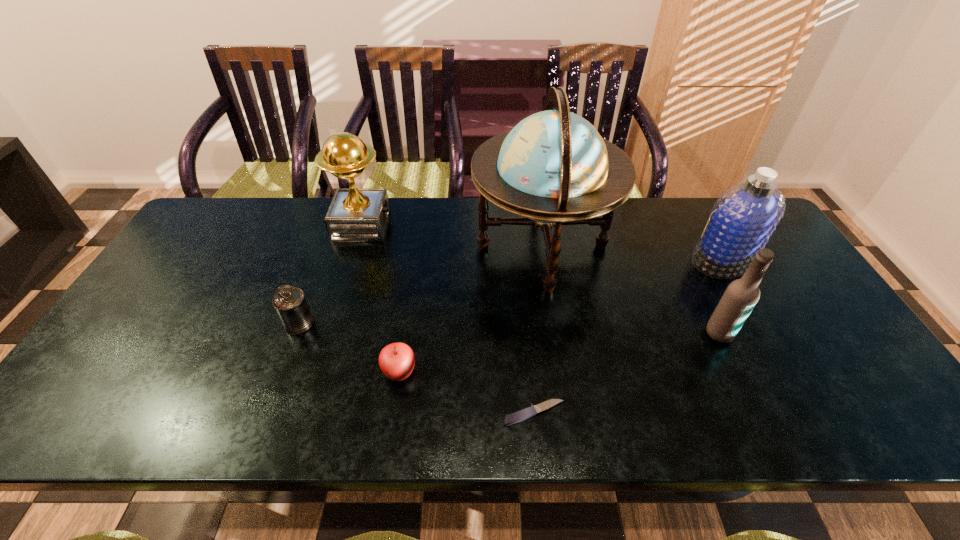
What are the coordinates of `the tallest object` in the screenshot? It's located at (553, 168).

This screenshot has height=540, width=960. In order to click on award in this screenshot , I will do `click(355, 214)`.

Where is `cleansing agent`? The width and height of the screenshot is (960, 540). cleansing agent is located at coordinates (742, 220).

Identify the location of beer bottle. (741, 296).

Identify the location of can. The height and width of the screenshot is (540, 960). (x=290, y=303).

Where is `the second shortest object`? This screenshot has height=540, width=960. the second shortest object is located at coordinates (396, 360).

The image size is (960, 540). What are the coordinates of `the fifth object from right to left` in the screenshot? It's located at (396, 360).

Find the location of a particular element. This screenshot has height=540, width=960. steak knife is located at coordinates (529, 412).

I want to click on the nearest object, so click(529, 412).

Find the location of a particular element. This screenshot has width=960, height=540. free space located on the surface of the globe is located at coordinates (348, 247).